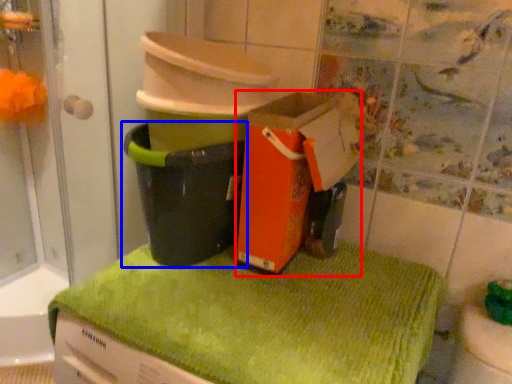
Question: Which point is further to the camera, cardboard box (highlighted by a red box) or waste container (highlighted by a blue box)?

Choices:
 (A) cardboard box
 (B) waste container

Answer: (B)